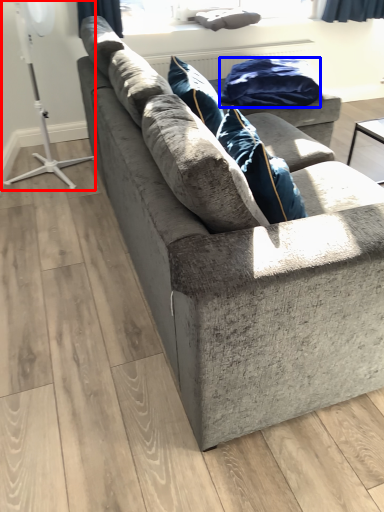
Question: Which object is closer to the camera taking this photo, fan (highlighted by a red box) or material (highlighted by a blue box)?

Choices:
 (A) fan
 (B) material

Answer: (A)